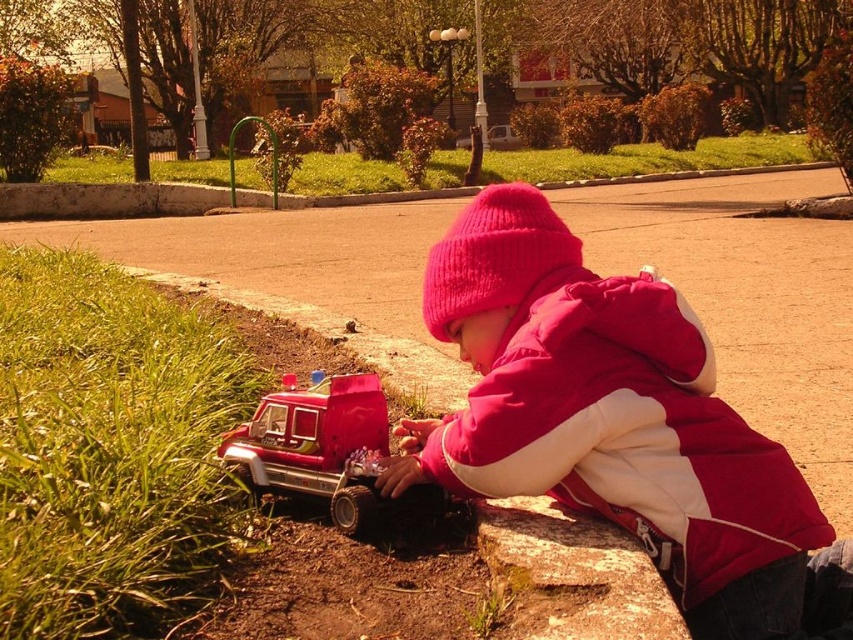
You are a delivery person trying to reach the metallic silver car at center. The shiny red plastic fire truck at lower left is blocking your path. Can you go around it without moving the fire truck?

The shiny red plastic fire truck at lower left is in front of the metallic silver car at center, so you can go around it by moving to the side since it is blocking the path directly.

You are standing in the park and want to take a photo of both point (399, 477) and point (514, 147) in the scene. Which point should you focus on first to ensure both are in clear view?

You should focus on point (399, 477) first because it is closer to the camera than point (514, 147), ensuring both points are in focus when using depth of field.

You are standing at the point with coordinates point (328,417) and want to walk towards the point (662,573). According to the scene, will you be moving towards the child or away from the child?

The point (662,573) is in front of point (328,417), so moving towards point (662,573) means you are moving towards the child.